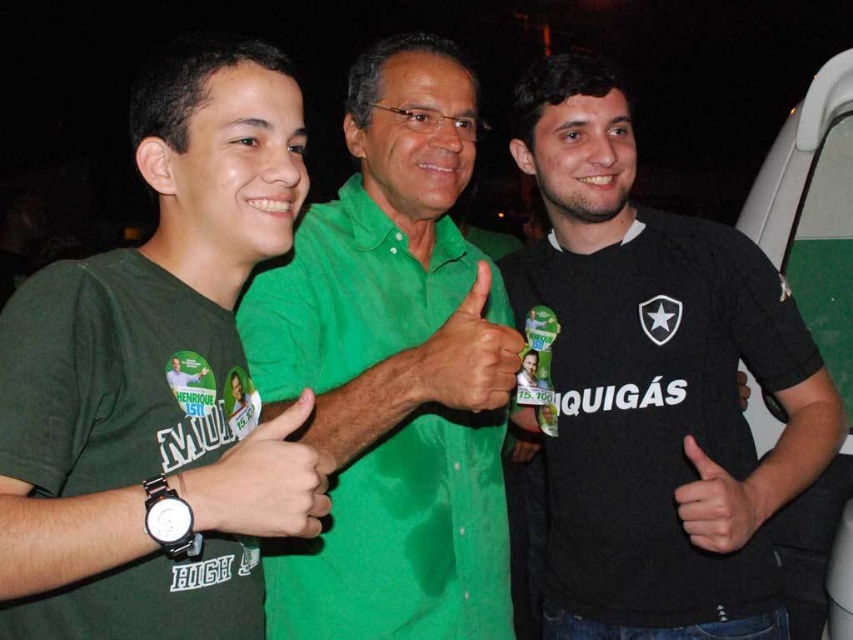
In the scene shown: Can you confirm if green matte shirt at left is positioned to the left of green linen shirt at center?

Indeed, green matte shirt at left is positioned on the left side of green linen shirt at center.

Which is behind, point (233, 358) or point (305, 330)?

Point (305, 330)

Does point (155, 600) come farther from viewer compared to point (332, 380)?

No, it is in front of (332, 380).

Locate an element on the screen. This screenshot has width=853, height=640. green matte shirt at left is located at coordinates (158, 378).

Which is in front, point (160, 456) or point (245, 467)?

Point (245, 467) is more forward.

Is green matte shirt at left bigger than black matte wristwatch at center?

Correct, green matte shirt at left is larger in size than black matte wristwatch at center.

Between point (90, 588) and point (270, 528), which one is positioned in front?

Positioned in front is point (270, 528).

Where is `green matte shirt at left`? green matte shirt at left is located at coordinates (158, 378).

This screenshot has height=640, width=853. I want to click on green matte shirt at left, so click(x=158, y=378).